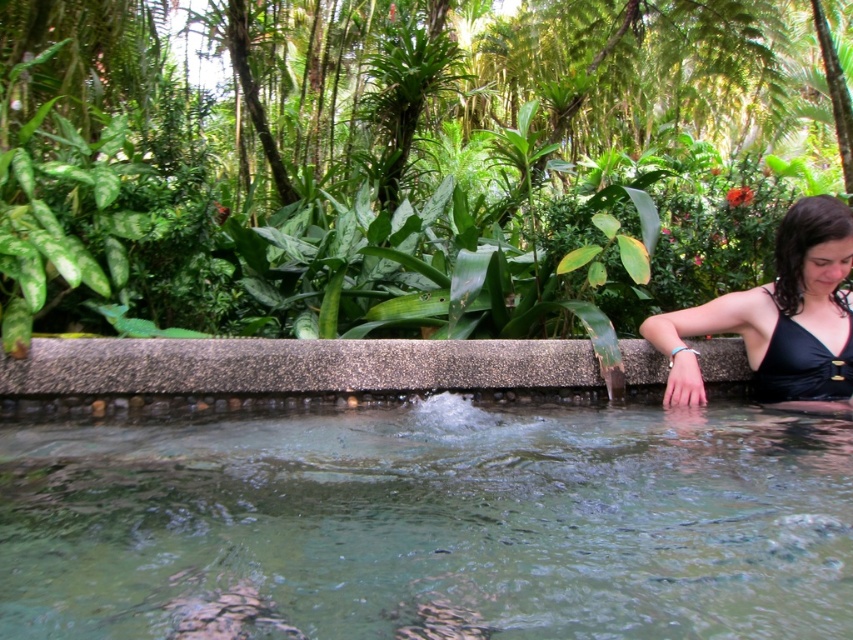
Who is lower down, green leafy plants at upper center or gray concrete ledge at center?

gray concrete ledge at center is below.

Is green leafy plants at upper center in front of gray concrete ledge at center?

No, it is behind gray concrete ledge at center.

Who is more distant from viewer, (640,20) or (309,362)?

The point (640,20) is behind.

At what (x,y) coordinates should I click in order to perform the action: click on green leafy plants at upper center. Please return your answer as a coordinate pair (x, y). Looking at the image, I should click on (403, 164).

Who is lower down, green leafy plants at upper center or black matte swimsuit at right?

Positioned lower is black matte swimsuit at right.

Is green leafy plants at upper center below black matte swimsuit at right?

Actually, green leafy plants at upper center is above black matte swimsuit at right.

Identify the location of green leafy plants at upper center. (403, 164).

This screenshot has width=853, height=640. I want to click on green leafy plants at upper center, so click(x=403, y=164).

Does point (828, 216) lie in front of point (796, 356)?

Yes.

What do you see at coordinates (778, 316) in the screenshot?
I see `black matte swimsuit at right` at bounding box center [778, 316].

Looking at this image, measure the distance between point (822, 330) and camera.

They are 7.52 feet apart.

This screenshot has width=853, height=640. Find the location of `black matte swimsuit at right`. black matte swimsuit at right is located at coordinates (778, 316).